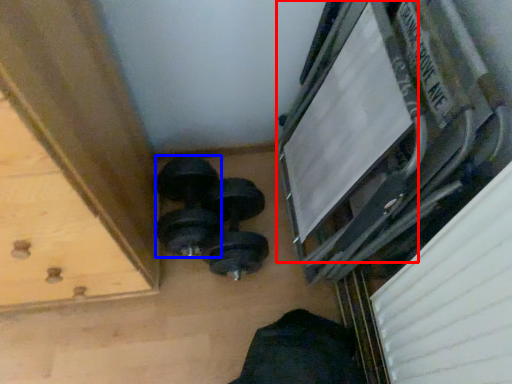
Question: Which of the following is the closest to the observer, window frame (highlighted by a red box) or dumbbell (highlighted by a blue box)?

Choices:
 (A) window frame
 (B) dumbbell

Answer: (A)